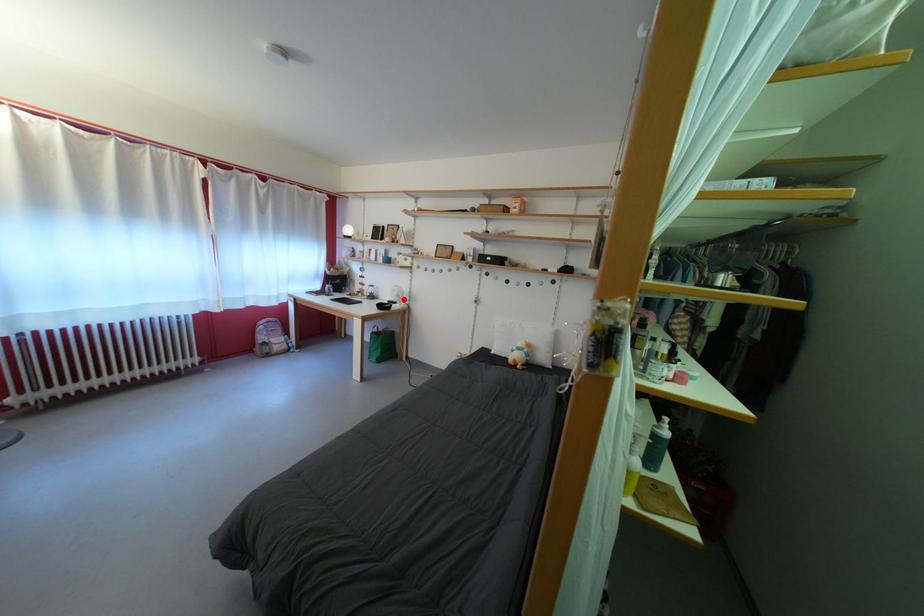
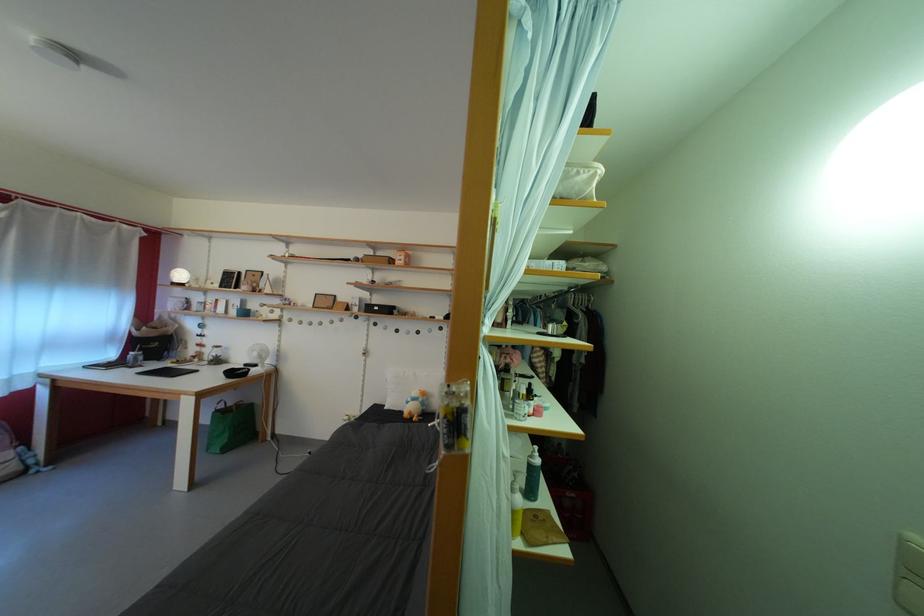
Question: I am providing you with two images of the same scene from different viewpoints. A red point is shown in image1. For the corresponding object point in image2, is it positioned nearer or farther from the camera?

Choices:
 (A) Nearer
 (B) Farther

Answer: (B)